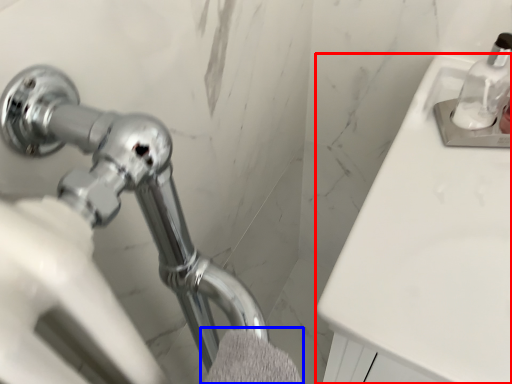
Question: Which object is further to the camera taking this photo, counter top (highlighted by a red box) or bath towel (highlighted by a blue box)?

Choices:
 (A) counter top
 (B) bath towel

Answer: (A)